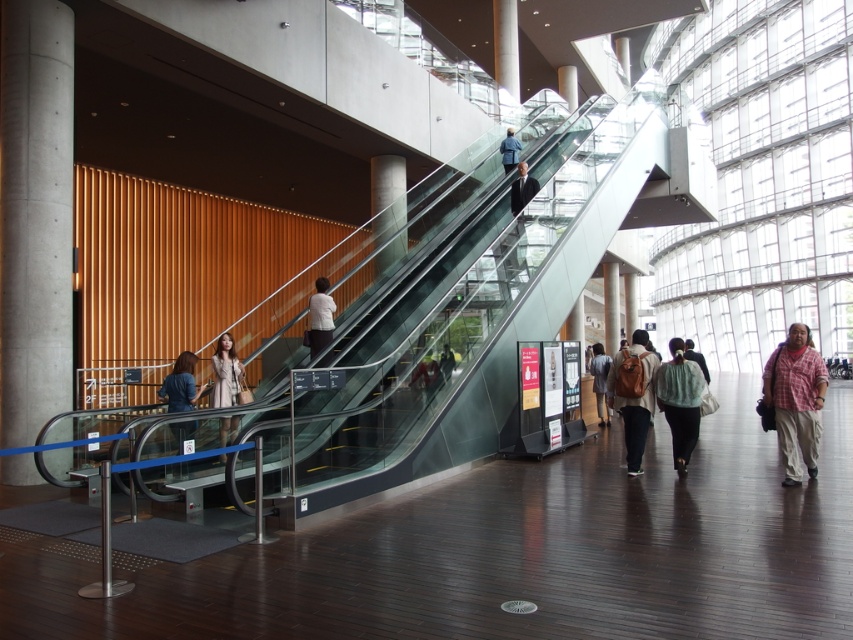
Looking at this image, you are standing at the entrance of the building and see the matte black jacket at lower left and the light blue fabric bag at center. Which object is closer to the ground?

The matte black jacket at lower left is positioned under the light blue fabric bag at center, so it is closer to the ground.

You are standing in the modern building and want to locate the concrete at left. According to the 2D coordinates provided, where should you look relative to the center of the image?

The concrete at left is located at coordinates point (35, 216), which is to the upper left of the center of the image.